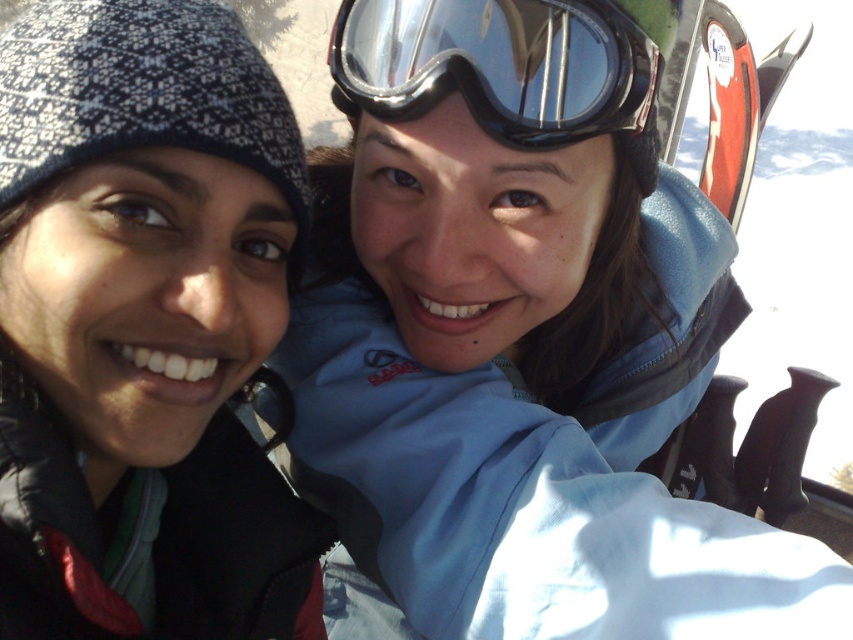
Consider the image. Can you confirm if blue fabric jacket at center is positioned to the right of black matte goggles at upper center?

Yes, blue fabric jacket at center is to the right of black matte goggles at upper center.

From the picture: Who is lower down, blue fabric jacket at center or black matte goggles at upper center?

blue fabric jacket at center is below.

Locate an element on the screen. blue fabric jacket at center is located at coordinates (521, 340).

Image resolution: width=853 pixels, height=640 pixels. I want to click on blue fabric jacket at center, so click(521, 340).

Between point (421, 440) and point (26, 42), which one is positioned in front?

Positioned in front is point (26, 42).

Is point (440, 620) positioned after point (9, 449)?

Yes, point (440, 620) is farther from viewer.

Find the location of `blue fabric jacket at center`. blue fabric jacket at center is located at coordinates (521, 340).

Is point (381, 161) closer to viewer compared to point (733, 48)?

That is True.

Is point (622, 604) positioned in front of point (741, 54)?

Yes, point (622, 604) is closer to viewer.

Where is `blue fabric jacket at center`? blue fabric jacket at center is located at coordinates (521, 340).